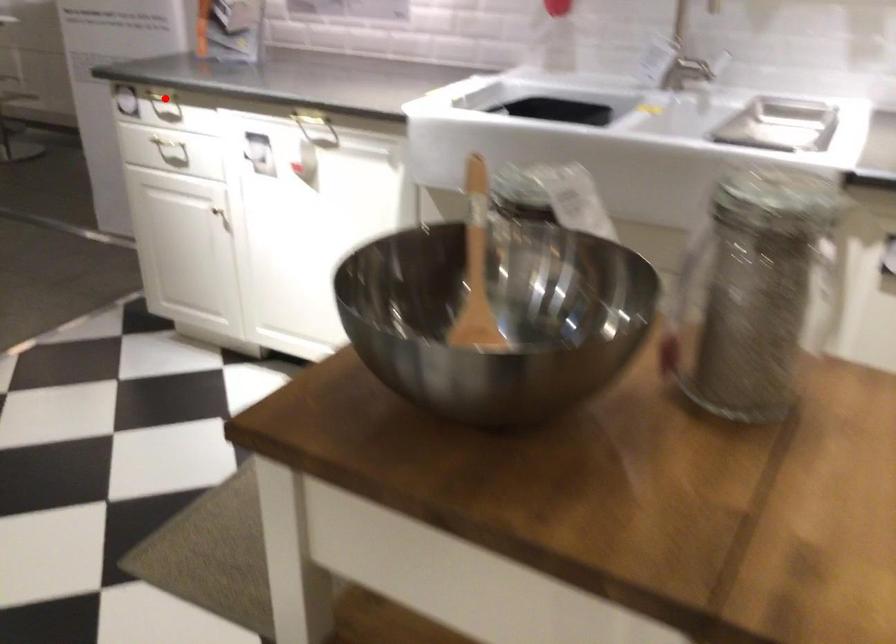
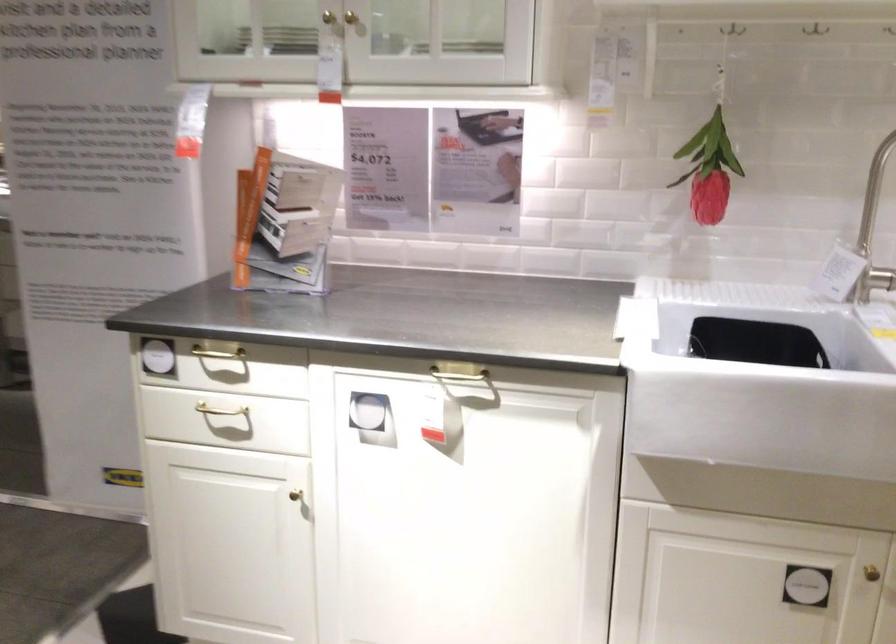
Locate, in the second image, the point that corresponds to the highlighted location in the first image.

(218, 353)